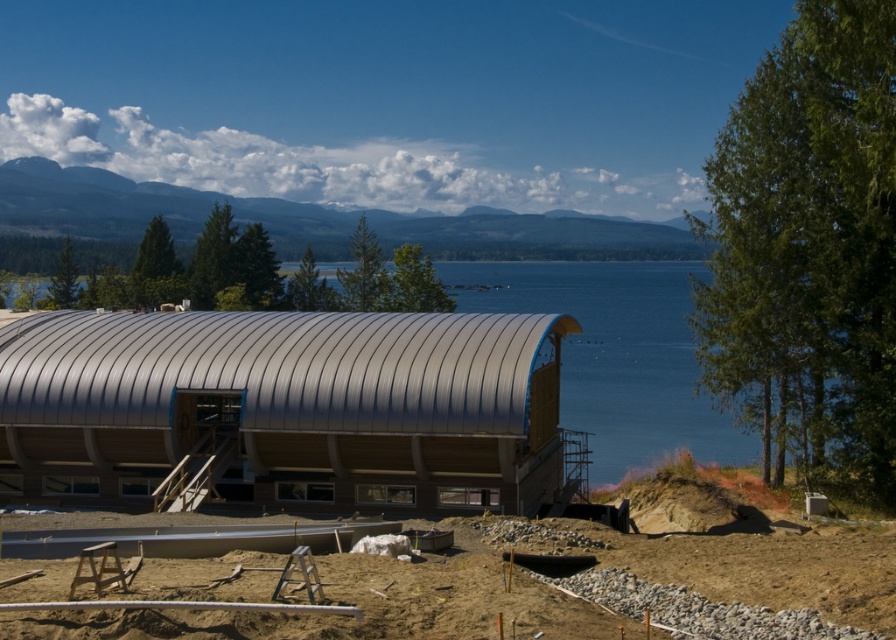
Is point (306, 397) positioned in front of point (634, 612)?

No, it is behind (634, 612).

Does metallic silver hut at center lie behind sandy dirt at lower center?

That is True.

You are a GUI agent. You are given a task and a screenshot of the screen. Output one action in this format:
    pyautogui.click(x=<x>, y=<y>)
    Task: Click on the metallic silver hut at center
    This screenshot has width=896, height=640.
    Given the screenshot: What is the action you would take?
    (285, 408)

I want to click on metallic silver hut at center, so click(x=285, y=408).